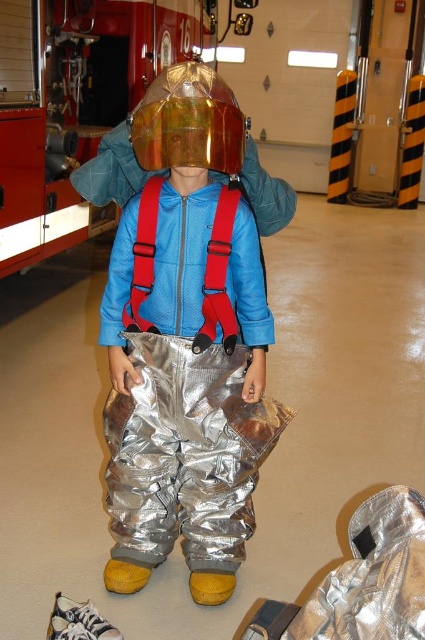
You are a firefighter trainee standing in the fire station. You need to move from your current position to the door located behind the brushed metal fire truck at upper center. Considering the space between you and the truck, can you walk around the silver reflective pants at center without any issues?

The brushed metal fire truck at upper center is wider than the silver reflective pants at center, so there should be enough space to walk around the silver reflective pants at center without any issues.

You are a safety inspector checking the fire station layout. The fire truck needs to be at least 10 feet away from any obstacles to ensure safe operation. Are you compliant with the safety regulations based on the distance between the brushed metal fire truck at upper center and the transparent plastic helmet at center?

The distance between the brushed metal fire truck at upper center and the transparent plastic helmet at center is 8.81 feet, which is less than the required 10 feet. Therefore, the fire station does not comply with the safety regulations.

The child is standing in front of the brushed metal fire truck at upper center. If the fire truck is located at coordinates 0.231 on the x and 0.071 on the y axis, what is the exact coordinate point of the fire truck?

The exact coordinate point of the brushed metal fire truck at upper center is 0.231 on the x axis and 0.071 on the y axis.